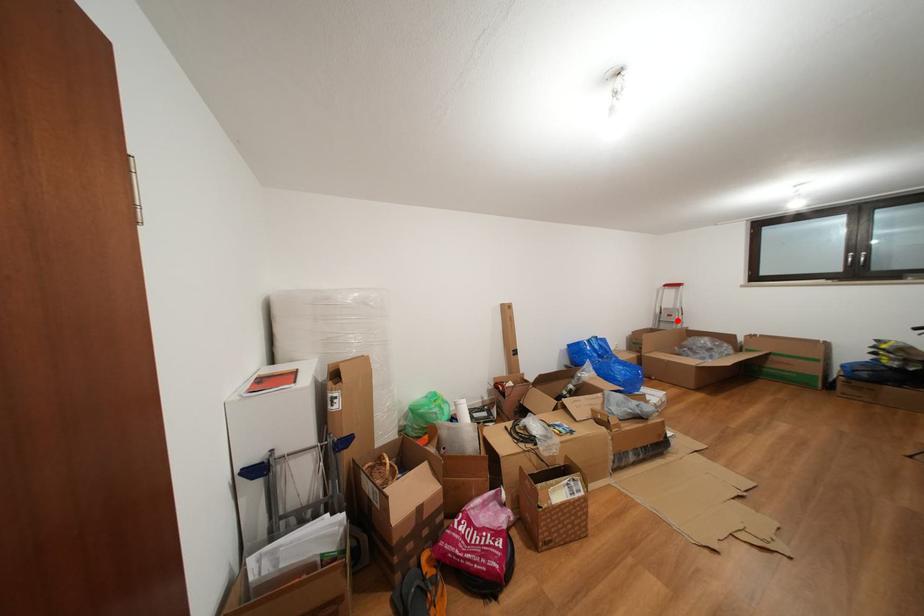
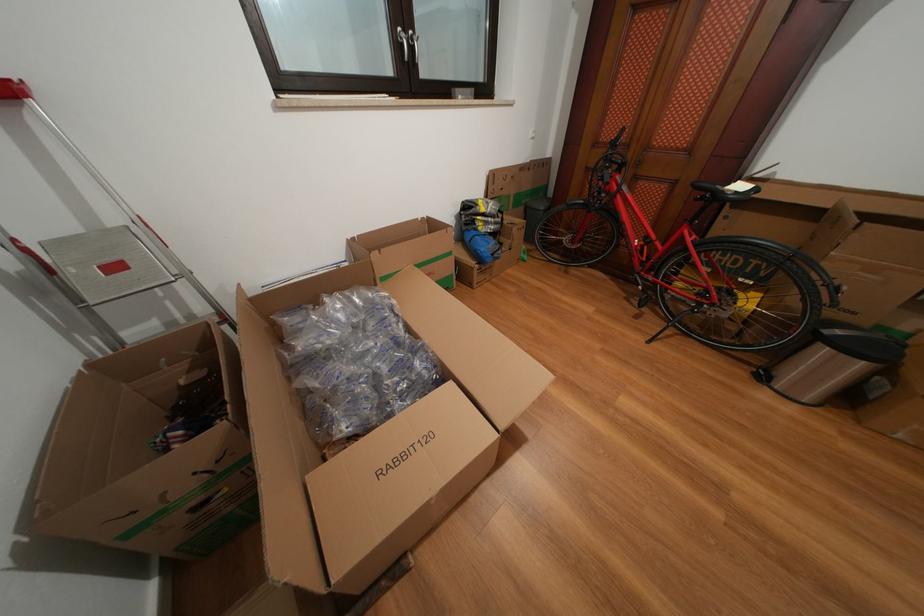
Locate, in the second image, the point that corresponds to the highlighted location in the first image.

(124, 273)